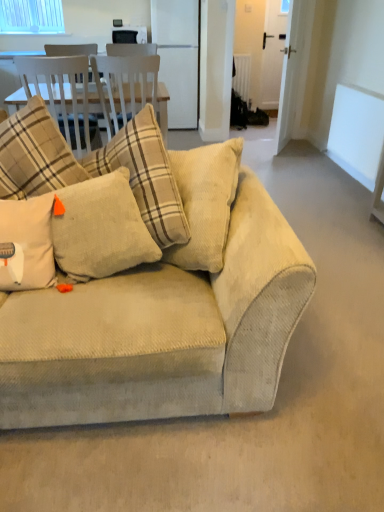
Question: From the image's perspective, relative to white glossy refrigerator at center, is clear glass window at upper left above or below?

Choices:
 (A) below
 (B) above

Answer: (B)

Question: Relative to white glossy refrigerator at center, is clear glass window at upper left in front or behind?

Choices:
 (A) behind
 (B) front

Answer: (A)

Question: Based on their relative distances, which object is nearer to the white glossy refrigerator at center?

Choices:
 (A) beige corduroy pillow at center, the first pillow positioned from the left
 (B) beige corduroy pillow at center, which is the 1th pillow in right-to-left order
 (C) white matte window screen at upper right
 (D) clear glass window at upper left
 (E) beige corduroy couch at center

Answer: (D)

Question: Based on their relative distances, which object is nearer to the white glossy refrigerator at center?

Choices:
 (A) beige corduroy pillow at center, which is the 1th pillow in right-to-left order
 (B) beige corduroy pillow at center, which is counted as the second pillow, starting from the right
 (C) clear glass window at upper left
 (D) white matte window screen at upper right
 (E) beige corduroy couch at center

Answer: (C)